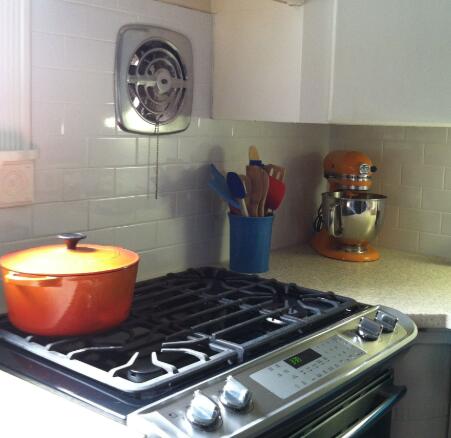
You are a GUI agent. You are given a task and a screenshot of the screen. Output one action in this format:
    pyautogui.click(x=<x>, y=<y>)
    Task: Click on the gas range burner
    The width and height of the screenshot is (451, 438).
    Given the screenshot: What is the action you would take?
    pyautogui.click(x=155, y=358), pyautogui.click(x=289, y=309), pyautogui.click(x=215, y=278)